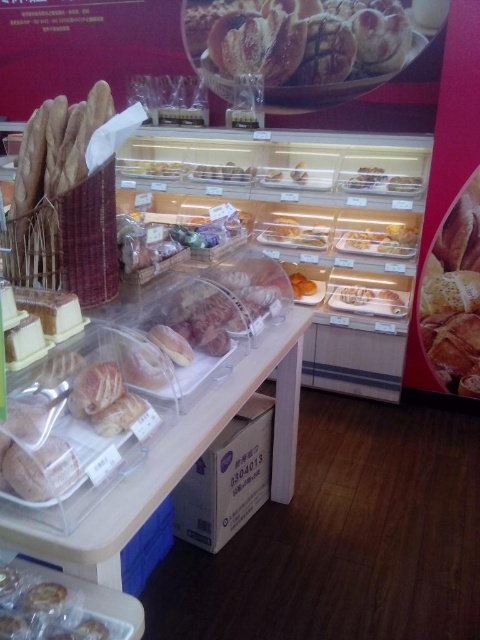
Question: Which object is farther from the camera taking this photo?

Choices:
 (A) translucent plastic pastries at lower left
 (B) golden brown flaky pastry at upper center
 (C) matte brown bread at right

Answer: (B)

Question: Which point appears closest to the camera in this image?

Choices:
 (A) (228, 33)
 (B) (463, 392)
 (C) (9, 611)

Answer: (C)

Question: Where is matte brown bread at right located in relation to translucent plastic pastries at lower left in the image?

Choices:
 (A) below
 (B) above

Answer: (B)

Question: Which of the following is the farthest from the observer?

Choices:
 (A) (456, 211)
 (B) (217, 6)

Answer: (B)

Question: Is golden brown flaky pastry at upper center to the right of matte brown bread at right from the viewer's perspective?

Choices:
 (A) yes
 (B) no

Answer: (B)

Question: Is matte brown bread at right wider than translucent plastic pastries at lower left?

Choices:
 (A) yes
 (B) no

Answer: (A)